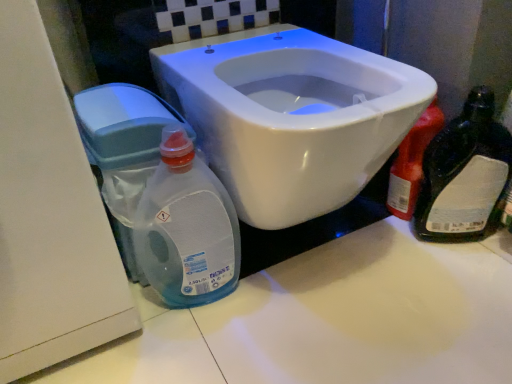
Locate an element on the screen. free location in front of transparent plastic bottle at lower left is located at coordinates click(x=206, y=353).